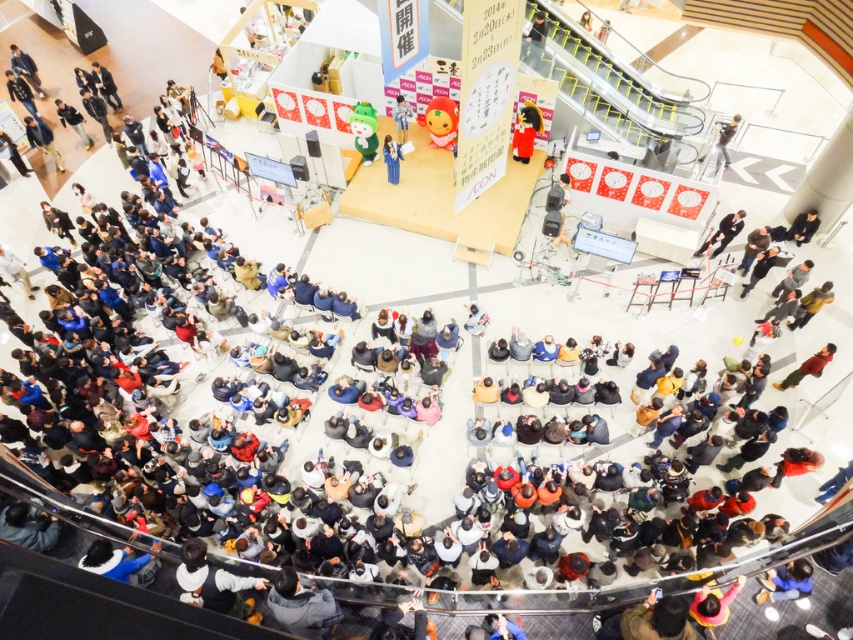
Does matte blue dress at center come behind matte blue kimono at center?

No, matte blue dress at center is in front of matte blue kimono at center.

Where is `matte blue dress at center`? Image resolution: width=853 pixels, height=640 pixels. matte blue dress at center is located at coordinates (392, 157).

Which of these two, matte red plush toy at center or matte blue kimono at center, stands taller?

With more height is matte red plush toy at center.

Which is below, matte red plush toy at center or matte blue kimono at center?

matte red plush toy at center is below.

Where is `matte red plush toy at center`? Image resolution: width=853 pixels, height=640 pixels. matte red plush toy at center is located at coordinates (525, 131).

Does light brown leather jacket at lower right appear on the left side of dark blue jeans at lower right?

In fact, light brown leather jacket at lower right is to the right of dark blue jeans at lower right.

Is light brown leather jacket at lower right shorter than dark blue jeans at lower right?

Yes, light brown leather jacket at lower right is shorter than dark blue jeans at lower right.

The image size is (853, 640). What are the coordinates of `light brown leather jacket at lower right` in the screenshot? It's located at (808, 368).

Where is `light brown leather jacket at lower right`? light brown leather jacket at lower right is located at coordinates (808, 368).